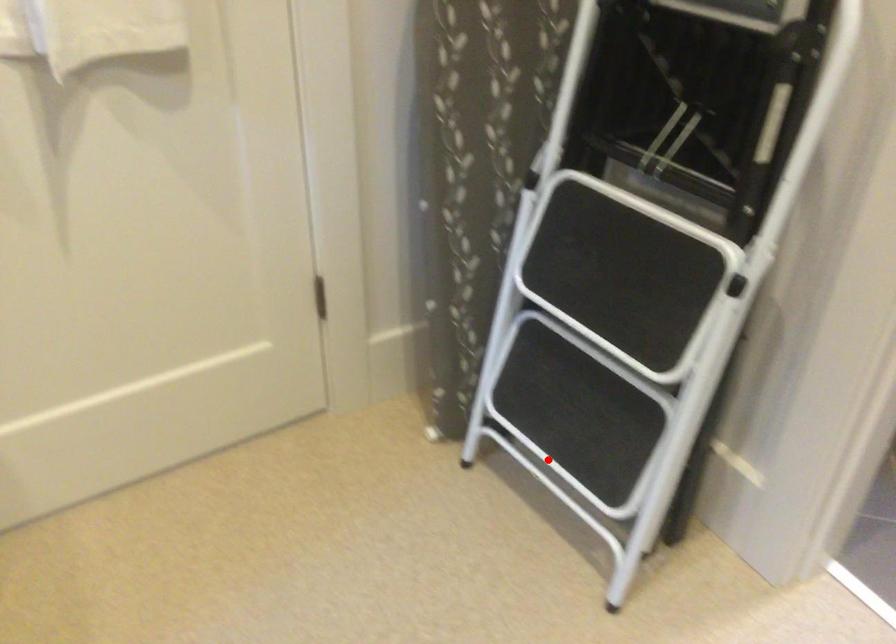
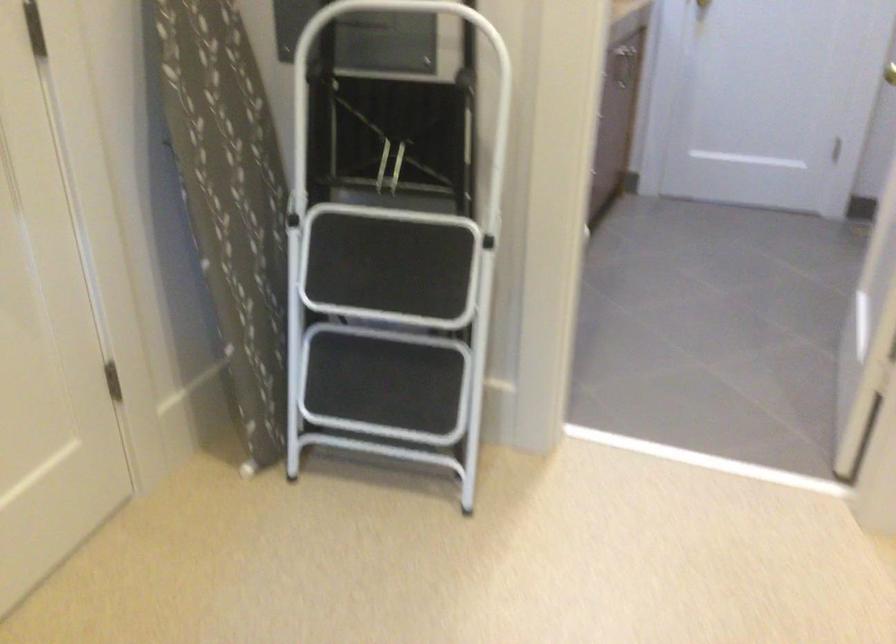
Question: I am providing you with two images of the same scene from different viewpoints. A red point is marked on the first image. Is the red point's position out of view in image 2?

Choices:
 (A) Yes
 (B) No

Answer: (A)